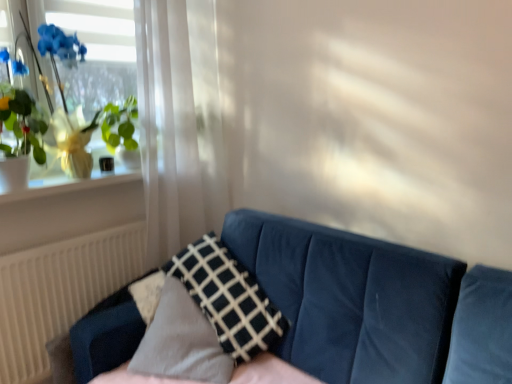
Question: Considering the positions of white glossy window sill at upper left and white textured radiator at lower left in the image, is white glossy window sill at upper left taller or shorter than white textured radiator at lower left?

Choices:
 (A) tall
 (B) short

Answer: (B)

Question: Is point (133, 173) positioned closer to the camera than point (56, 284)?

Choices:
 (A) farther
 (B) closer

Answer: (A)

Question: Which is nearer to the velvet blue couch at center?

Choices:
 (A) dark blue fabric pillow at center
 (B) white glossy window sill at upper left
 (C) white sheer curtain at left
 (D) white textured radiator at lower left
 (E) green leafy plant at left

Answer: (A)

Question: Which is nearer to the dark blue fabric pillow at center?

Choices:
 (A) velvet blue couch at center
 (B) white textured radiator at lower left
 (C) green leafy plant at left
 (D) white glossy window sill at upper left
 (E) white sheer curtain at left

Answer: (A)